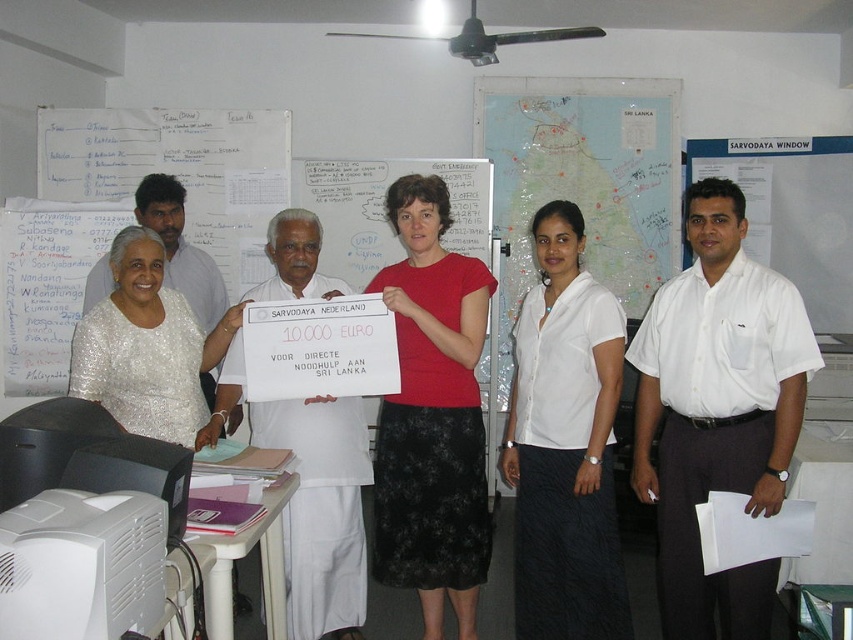
You are standing in the office and need to locate the white shirt at center. Where is it positioned in the room?

The white shirt at center is located at the 2D coordinates point (717, 412) in the room.

You are standing at the entrance of the room and want to locate the white shirt at center. According to the coordinates provided, in which direction should you look relative to your current position?

The white shirt at center is located at coordinates point (717, 412), which means it is positioned to the right and slightly below the center of the room. Therefore, you should look towards the right and slightly downward from the center to locate it.

You are organizing a charity event and need to place a donation box between the red matte shirt at center and the white shirt at left. Based on their positions, where should you position the donation box relative to these two individuals?

The donation box should be placed between the red matte shirt at center and the white shirt at left. Since the red matte shirt at center is located below the white shirt at left, the donation box should be positioned below the white shirt at left and above the red matte shirt at center to be equidistant between them.